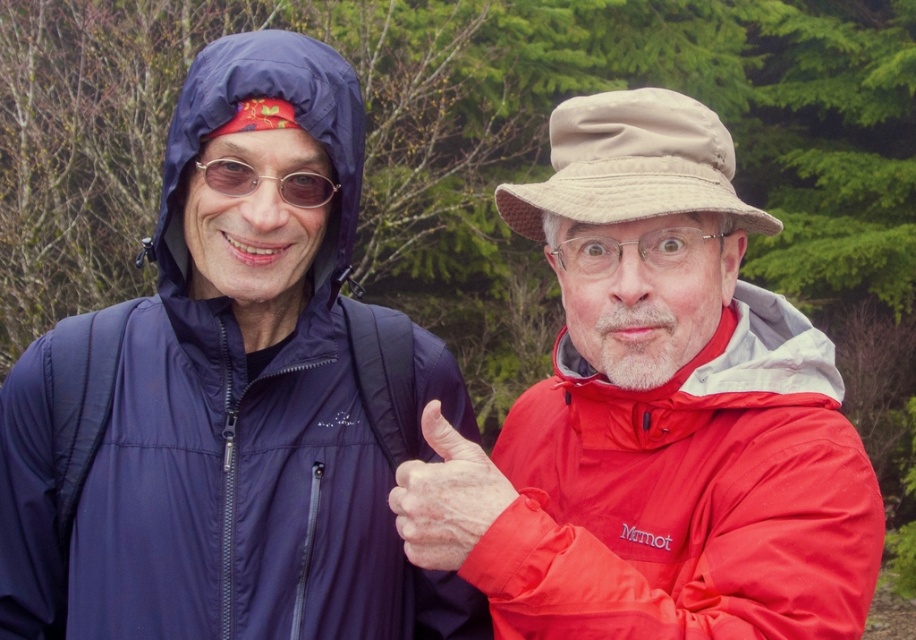
Question: Is matte red jacket at right wider than smooth skin hand at center?

Choices:
 (A) yes
 (B) no

Answer: (A)

Question: Which point is farther from the camera taking this photo?

Choices:
 (A) (311, 256)
 (B) (200, 163)
 (C) (837, 381)
 (D) (446, 556)

Answer: (A)

Question: Which of the following is the farthest from the observer?

Choices:
 (A) (244, 188)
 (B) (104, 596)
 (C) (603, 493)

Answer: (C)

Question: Does navy blue waterproof jacket at left have a smaller size compared to matte plastic glasses at upper center?

Choices:
 (A) yes
 (B) no

Answer: (B)

Question: Which point appears closest to the camera in this image?

Choices:
 (A) (222, 168)
 (B) (761, 554)

Answer: (B)

Question: Can you confirm if navy blue waterproof jacket at left is positioned to the right of smooth skin hand at center?

Choices:
 (A) no
 (B) yes

Answer: (A)